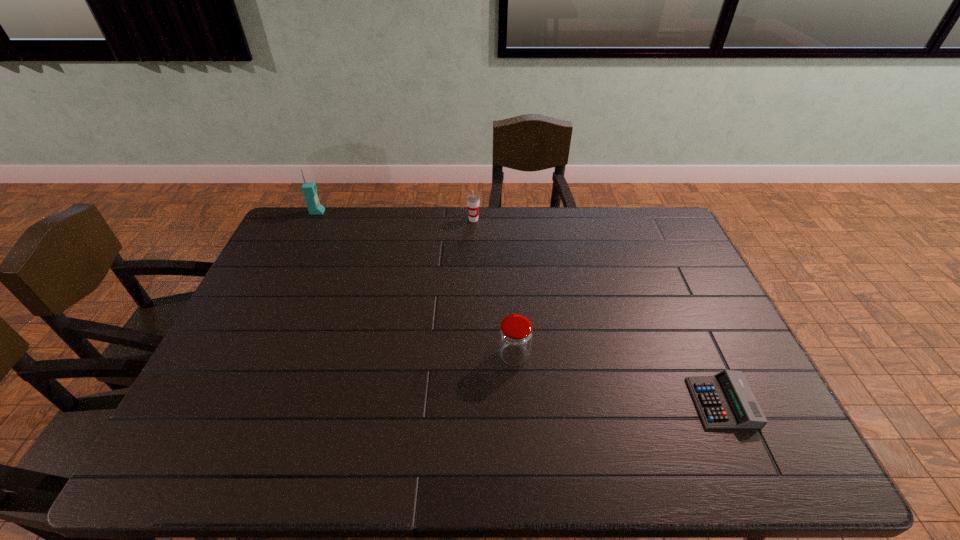
At what (x,y) coordinates should I click in order to perform the action: click on free point between the nearest object and the cup. Please return your answer as a coordinate pair (x, y). This screenshot has width=960, height=540. Looking at the image, I should click on (598, 311).

You are a GUI agent. You are given a task and a screenshot of the screen. Output one action in this format:
    pyautogui.click(x=<x>, y=<y>)
    Task: Click on the free spot between the nearest object and the third farthest object
    The width and height of the screenshot is (960, 540).
    Given the screenshot: What is the action you would take?
    pyautogui.click(x=618, y=379)

What are the coordinates of `empty space between the third nearest object and the leftmost object` in the screenshot? It's located at (396, 216).

Where is `empty location between the cellular telephone and the third nearest object`? empty location between the cellular telephone and the third nearest object is located at coordinates (396, 216).

Choose which object is the nearest neighbor to the second nearest object. Please provide its 2D coordinates. Your answer should be formatted as a tuple, i.e. [(x, y)], where the tuple contains the x and y coordinates of a point satisfying the conditions above.

[(725, 400)]

What are the coordinates of `the second closest object to the leftmost object` in the screenshot? It's located at (515, 335).

Identify the location of free spot that satisfies the following two spatial constraints: 1. on the front side of the second nearest object; 2. on the right side of the shortest object. This screenshot has height=540, width=960. (517, 402).

At what (x,y) coordinates should I click in order to perform the action: click on free space in the image that satisfies the following two spatial constraints: 1. on the keypad of the second object from right to left; 2. on the left side of the farthest object. Please return your answer as a coordinate pair (x, y). The width and height of the screenshot is (960, 540). Looking at the image, I should click on (251, 356).

Identify the location of free region that satisfies the following two spatial constraints: 1. on the keypad of the second nearest object; 2. on the right side of the farthest object. The image size is (960, 540). (251, 356).

You are a GUI agent. You are given a task and a screenshot of the screen. Output one action in this format:
    pyautogui.click(x=<x>, y=<y>)
    Task: Click on the blank space that satisfies the following two spatial constraints: 1. on the keypad of the third farthest object; 2. on the left side of the cellular telephone
    The height and width of the screenshot is (540, 960).
    Given the screenshot: What is the action you would take?
    pyautogui.click(x=251, y=356)